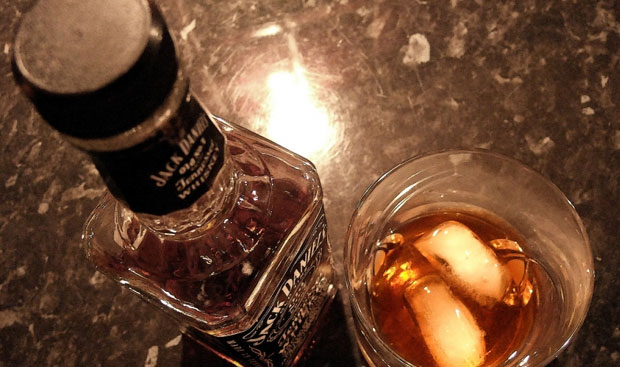
Find the location of a particular element. whiskey bottle is located at coordinates (246, 274).